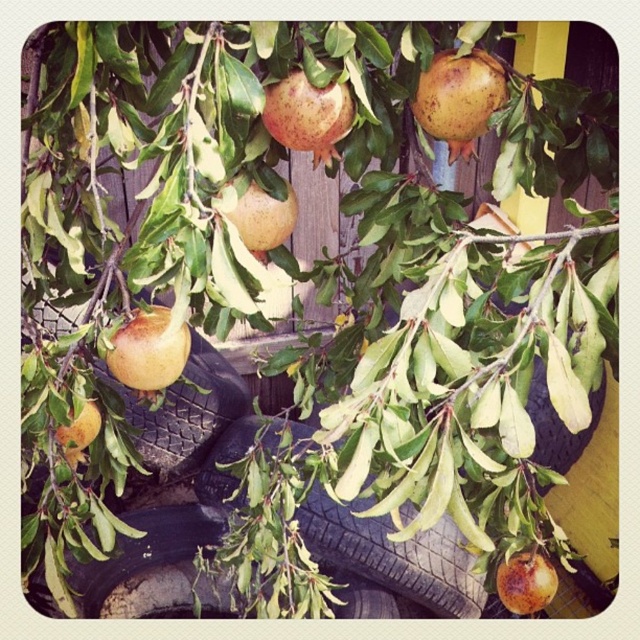
Between black rubber tire at lower right and brown matte pomegranate at center, which one appears on the left side from the viewer's perspective?

From the viewer's perspective, brown matte pomegranate at center appears more on the left side.

Does point (580, 444) come farther from viewer compared to point (269, 234)?

Yes, point (580, 444) is behind point (269, 234).

The width and height of the screenshot is (640, 640). I want to click on black rubber tire at lower right, so click(557, 422).

Based on the photo, can you confirm if rough textured pomegranate at upper center is shorter than rustic brown pomegranate at center?

Incorrect, rough textured pomegranate at upper center's height does not fall short of rustic brown pomegranate at center's.

Which is behind, point (436, 60) or point (346, 96)?

Point (436, 60)

Does point (436, 124) lie in front of point (310, 145)?

No, (436, 124) is behind (310, 145).

Image resolution: width=640 pixels, height=640 pixels. What are the coordinates of `rough textured pomegranate at upper center` in the screenshot? It's located at (458, 99).

Between black rubber tire at lower right and ripe orange pomegranate at lower left, which one appears on the left side from the viewer's perspective?

ripe orange pomegranate at lower left is more to the left.

Is point (541, 376) closer to viewer compared to point (54, 433)?

No, (541, 376) is behind (54, 433).

Locate an element on the screen. The height and width of the screenshot is (640, 640). black rubber tire at lower right is located at coordinates (557, 422).